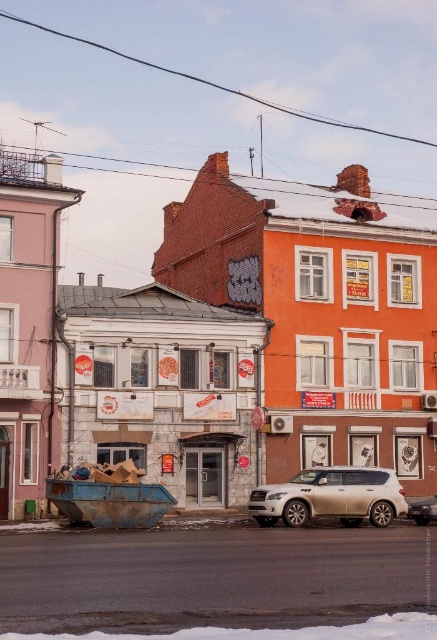
You are a delivery person trying to park your shiny silver suv at center in the parking spot near the white powdery snow at lower center. Can you fit your vehicle there without overlapping the snow?

The white powdery snow at lower center is smaller than the shiny silver suv at center, so the suv may not fit entirely within the snow area. However, since the snow is at the lower center and the suv is at the center, there might be enough space around the snow for parking without overlapping it. Check the exact dimensions before proceeding.

You are standing at the point labeled point (x=330, y=497) in the image. What object are you directly facing?

You are directly facing the satin white suv at center.